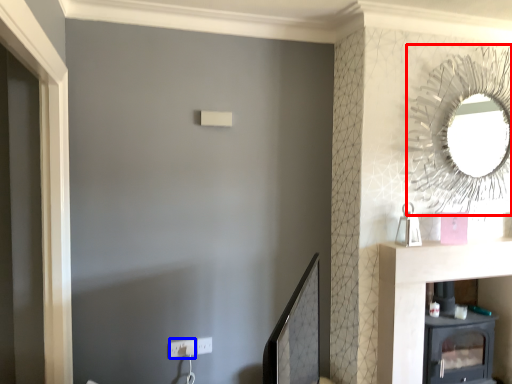
Question: Which point is further to the camera, mirror (highlighted by a red box) or electric outlet (highlighted by a blue box)?

Choices:
 (A) mirror
 (B) electric outlet

Answer: (B)